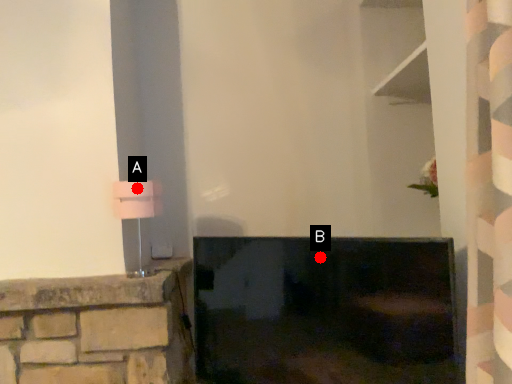
Question: Two points are circled on the image, labeled by A and B beside each circle. Which point is farther from the camera taking this photo?

Choices:
 (A) A is further
 (B) B is further

Answer: (A)